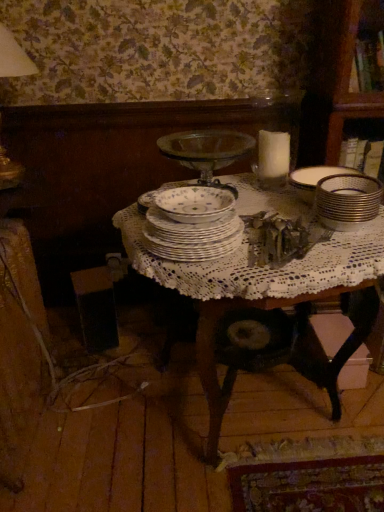
At what (x,y) coordinates should I click in order to perform the action: click on free point below white lace tablecloth at center (from a real-world perspective). Please return your answer as a coordinate pair (x, y). This screenshot has width=384, height=512. Looking at the image, I should click on (250, 410).